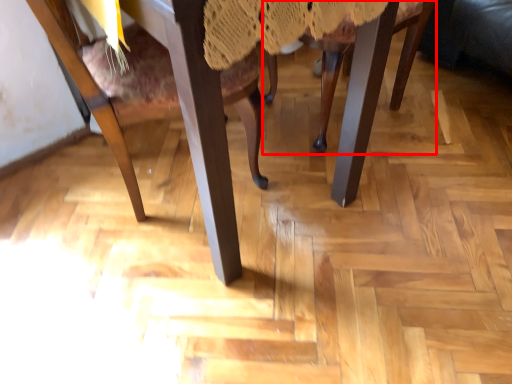
Question: Considering the relative positions of chair (annotated by the red box) and chair in the image provided, where is chair (annotated by the red box) located with respect to the staircase?

Choices:
 (A) left
 (B) right

Answer: (B)